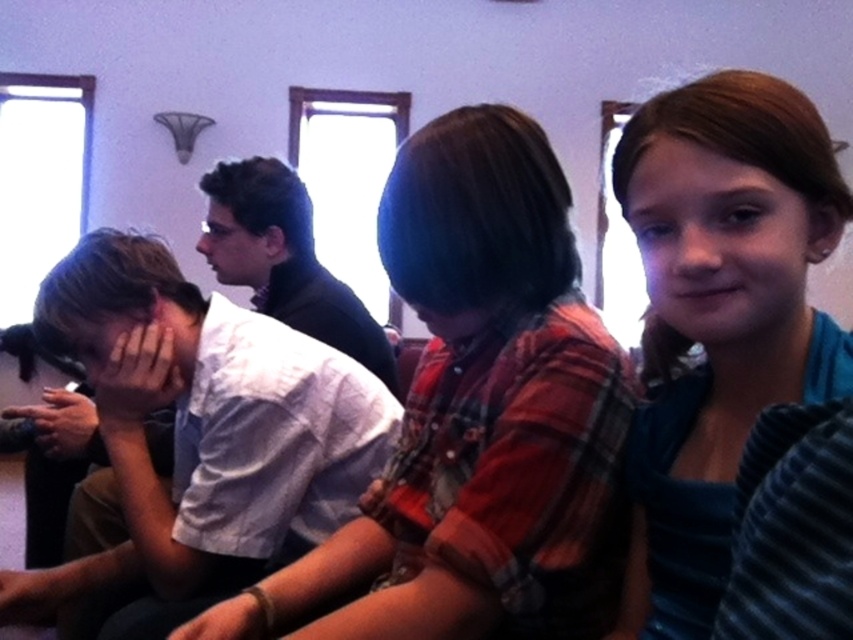
You are a photographer standing in the room and want to take a photo that includes both the smooth brown hair at upper right and the dark blue shirt at center. Given that your camera has a maximum focus range of 1.25 meters, will you be able to capture both subjects clearly in the same frame?

The smooth brown hair at upper right and the dark blue shirt at center are 1.30 meters apart from each other. Since the distance between them exceeds the camera maximum focus range of 1.25 meters, the camera cannot focus on both subjects simultaneously. You will need to adjust your position or use a different camera setting to ensure both are in focus.